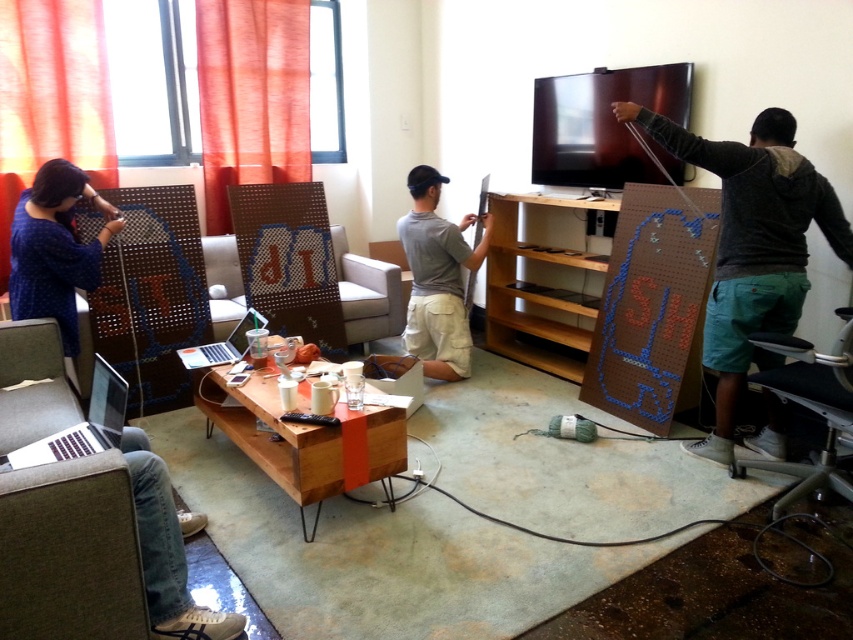
Question: In this image, where is blue fabric shirt at left located relative to gray matte shirt at center?

Choices:
 (A) below
 (B) above

Answer: (B)

Question: Estimate the real-world distances between objects in this image. Which object is farther from the gray matte shirt at center?

Choices:
 (A) green cotton shorts at right
 (B) blue fabric shirt at left

Answer: (B)

Question: Can you confirm if green cotton shorts at right is smaller than gray matte shirt at center?

Choices:
 (A) no
 (B) yes

Answer: (A)

Question: Which object appears farthest from the camera in this image?

Choices:
 (A) blue fabric shirt at left
 (B) green cotton shorts at right
 (C) gray matte shirt at center

Answer: (C)

Question: Is green cotton shorts at right to the left of blue fabric shirt at left from the viewer's perspective?

Choices:
 (A) yes
 (B) no

Answer: (B)

Question: Which of the following is the farthest from the observer?

Choices:
 (A) (708, 300)
 (B) (68, 216)

Answer: (B)